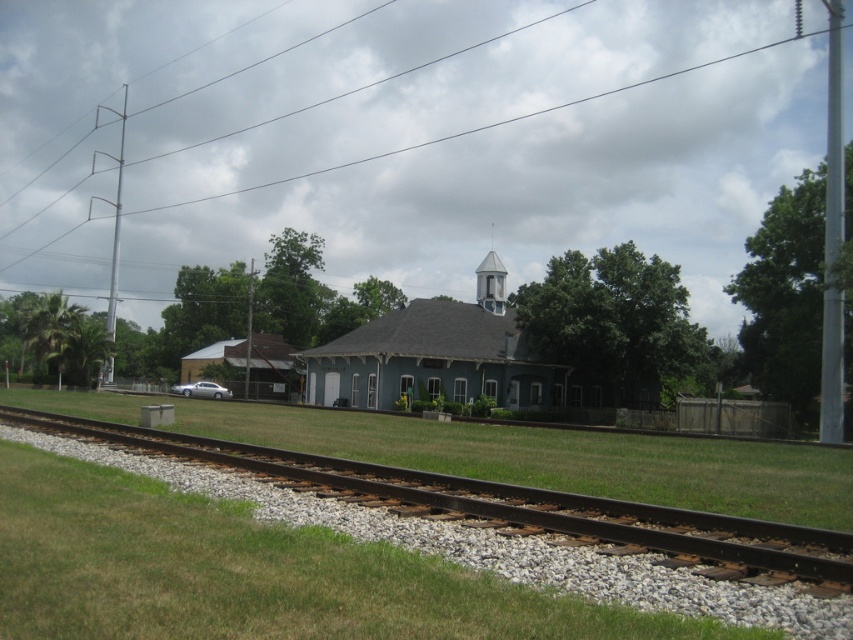
Question: Can you confirm if brown gravel track at lower left is positioned to the left of white painted wood bell tower at upper center?

Choices:
 (A) no
 (B) yes

Answer: (B)

Question: Considering the relative positions of light blue wood church at center and white painted wood bell tower at upper center in the image provided, where is light blue wood church at center located with respect to white painted wood bell tower at upper center?

Choices:
 (A) right
 (B) left

Answer: (B)

Question: Which point appears closest to the camera in this image?

Choices:
 (A) (123, 429)
 (B) (480, 296)

Answer: (A)

Question: Which object is the farthest from the brown gravel track at lower left?

Choices:
 (A) light blue wood church at center
 (B) white painted wood bell tower at upper center

Answer: (B)

Question: Which object appears closest to the camera in this image?

Choices:
 (A) brown gravel track at lower left
 (B) light blue wood church at center
 (C) white painted wood bell tower at upper center

Answer: (A)

Question: Is light blue wood church at center bigger than white painted wood bell tower at upper center?

Choices:
 (A) no
 (B) yes

Answer: (A)